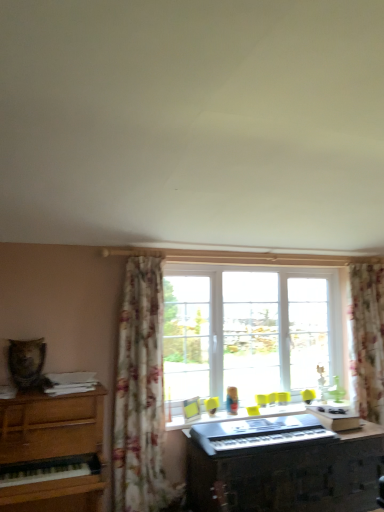
Question: Is floral fabric curtain at center, the first curtain from the front, placed right next to metallic silver keyboard at center?

Choices:
 (A) no
 (B) yes

Answer: (A)

Question: Could you tell me if floral fabric curtain at center, which is the 1th curtain in left-to-right order, is turned towards metallic silver keyboard at center?

Choices:
 (A) no
 (B) yes

Answer: (A)

Question: Considering the relative sizes of floral fabric curtain at center, which is the 1th curtain in left-to-right order, and metallic silver keyboard at center in the image provided, is floral fabric curtain at center, which is the 1th curtain in left-to-right order, thinner than metallic silver keyboard at center?

Choices:
 (A) yes
 (B) no

Answer: (A)

Question: From the image's perspective, does floral fabric curtain at center, which is the 1th curtain in left-to-right order, appear higher than metallic silver keyboard at center?

Choices:
 (A) yes
 (B) no

Answer: (A)

Question: Is floral fabric curtain at center, which is the 1th curtain in left-to-right order, at the left side of metallic silver keyboard at center?

Choices:
 (A) no
 (B) yes

Answer: (B)

Question: Considering the relative sizes of floral fabric curtain at center, the 2th curtain positioned from the back, and metallic silver keyboard at center in the image provided, is floral fabric curtain at center, the 2th curtain positioned from the back, wider than metallic silver keyboard at center?

Choices:
 (A) no
 (B) yes

Answer: (A)

Question: Can you confirm if floral fabric curtain at center, which is the 1th curtain in left-to-right order, is positioned to the right of black plastic musical keyboard at center?

Choices:
 (A) no
 (B) yes

Answer: (A)

Question: Does floral fabric curtain at center, which appears as the second curtain when viewed from the right, appear on the left side of black plastic musical keyboard at center?

Choices:
 (A) no
 (B) yes

Answer: (B)

Question: Can you confirm if floral fabric curtain at center, the 2th curtain positioned from the back, is thinner than black plastic musical keyboard at center?

Choices:
 (A) no
 (B) yes

Answer: (B)

Question: Is floral fabric curtain at center, the first curtain from the front, positioned behind black plastic musical keyboard at center?

Choices:
 (A) yes
 (B) no

Answer: (A)

Question: Is floral fabric curtain at center, which appears as the second curtain when viewed from the right, bigger than black plastic musical keyboard at center?

Choices:
 (A) yes
 (B) no

Answer: (A)

Question: From the image's perspective, is floral fabric curtain at center, the first curtain from the front, beneath black plastic musical keyboard at center?

Choices:
 (A) yes
 (B) no

Answer: (B)

Question: Is floral fabric curtain at center, the 2th curtain positioned from the back, far from wooden piano at left?

Choices:
 (A) no
 (B) yes

Answer: (A)